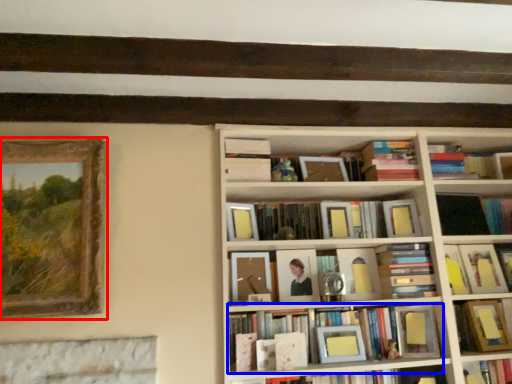
Question: Which point is further to the camera, picture frame (highlighted by a red box) or book (highlighted by a blue box)?

Choices:
 (A) picture frame
 (B) book

Answer: (B)